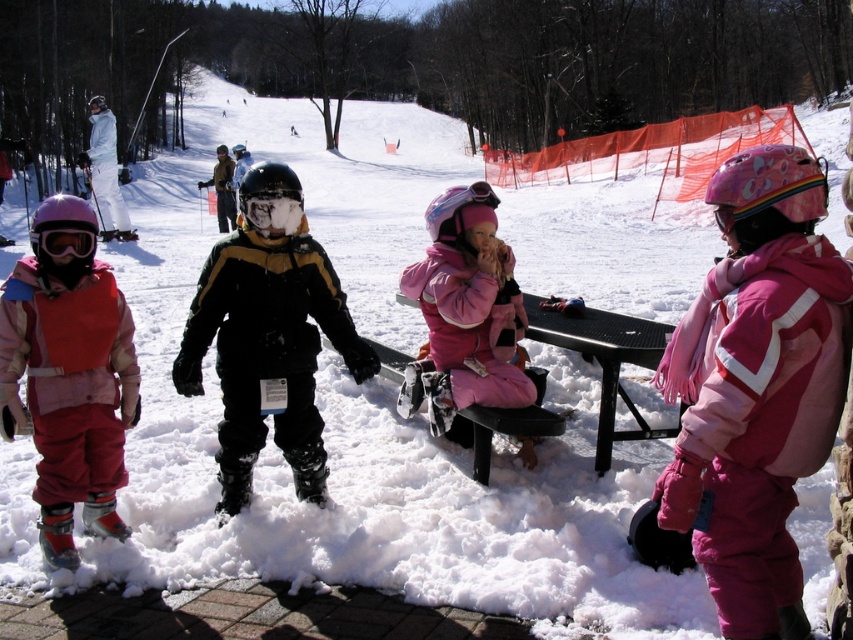
You are standing at the picnic table and want to reach the chair located at point (39, 499). There is an obstacle at point (212, 323). Will you be able to walk straight to the chair without going around the obstacle?

Since point (212, 323) is behind point (39, 499), you can walk straight to the chair at point (39, 499) without needing to go around the obstacle at point (212, 323).

You are standing at the point marked as point (456, 371) in the image. You want to walk towards the ski lift located 15 feet away from you. Is the ski lift within your walking distance?

The distance of point (456, 371) from viewer is 13.89 feet, so the ski lift located 15 feet away is beyond your current position. Therefore, the ski lift is within walking distance since 15 feet is just slightly further than your current position at 13.89 feet.

You are standing at the picnic table where the children are. You want to walk to the point marked as point [427,227]. Which direction should you walk relative to point [55,259]?

You should walk towards the direction behind point [55,259] because point [427,227] is located behind it.